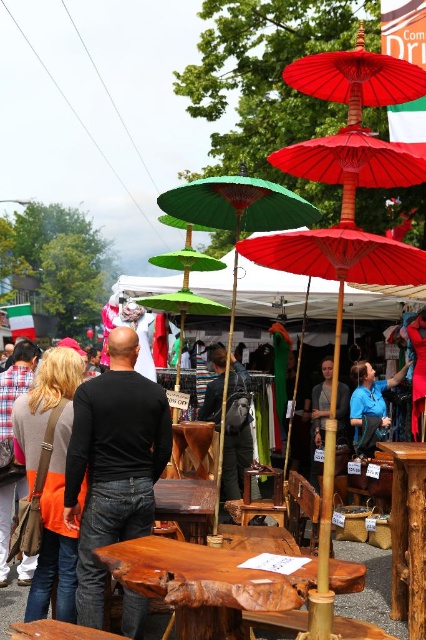
Is black sweater at center taller than orange fabric at left?

Correct, black sweater at center is much taller as orange fabric at left.

Which is behind, point (94, 600) or point (8, 548)?

Point (8, 548)

Is point (89, 604) more distant than point (17, 381)?

No, (89, 604) is closer to viewer.

At what (x,y) coordinates should I click in order to perform the action: click on black sweater at center. Please return your answer as a coordinate pair (x, y). Image resolution: width=426 pixels, height=640 pixels. Looking at the image, I should click on (114, 464).

Is orange fabric at left to the right of blue fabric at center from the viewer's perspective?

No, orange fabric at left is not to the right of blue fabric at center.

Between orange fabric at left and blue fabric at center, which one is positioned lower?

Positioned lower is blue fabric at center.

Measure the distance between orange fabric at left and camera.

orange fabric at left is 4.89 meters from camera.

Locate an element on the screen. orange fabric at left is located at coordinates (16, 384).

Which of these two, natural wood picnic table at center or blue fabric at center, stands taller?

Standing taller between the two is blue fabric at center.

Does natural wood picnic table at center have a lesser height compared to blue fabric at center?

Indeed, natural wood picnic table at center has a lesser height compared to blue fabric at center.

Is point (296, 586) farther from viewer compared to point (379, 404)?

No, (296, 586) is in front of (379, 404).

Identify the location of natural wood picnic table at center. (204, 582).